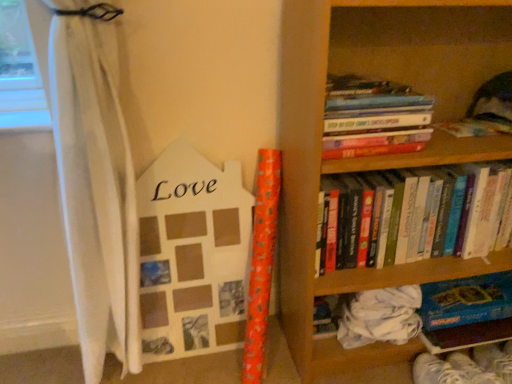
Describe the element at coordinates (374, 156) in the screenshot. I see `wooden bookcase at right` at that location.

Locate an element on the screen. The height and width of the screenshot is (384, 512). blue cardboard book at lower right, which appears as the 1th book when ordered from the bottom is located at coordinates (466, 312).

From a real-world perspective, is blue cardboard book at lower right, the third book viewed from the top, physically above hardcover books at upper right, positioned as the 2th book in bottom-to-top order?

Incorrect, from a real-world perspective, blue cardboard book at lower right, the third book viewed from the top, is lower than hardcover books at upper right, positioned as the 2th book in bottom-to-top order.

From the picture: Which of these two, blue cardboard book at lower right, the third book viewed from the top, or hardcover books at upper right, positioned as the 2th book in bottom-to-top order, is thinner?

Thinner between the two is blue cardboard book at lower right, the third book viewed from the top.

Locate an element on the screen. Image resolution: width=512 pixels, height=384 pixels. book below the hardcover books at upper right, positioned as the 2th book in bottom-to-top order (from a real-world perspective) is located at coordinates tap(466, 312).

Is point (288, 6) positioned in front of point (187, 265)?

Yes.

Which is in front, wooden bookcase at right or wooden photo frame at left?

wooden bookcase at right is closer to the camera.

How much distance is there between wooden bookcase at right and wooden photo frame at left?

A distance of 14.42 inches exists between wooden bookcase at right and wooden photo frame at left.

From the image's perspective, between wooden bookcase at right and wooden photo frame at left, which one is located above?

wooden bookcase at right is shown above in the image.

From a real-world perspective, which object rests below the other?

blue cardboard book at lower right, the third book viewed from the top, is physically lower.

Considering the points (447, 329) and (169, 353), which point is behind, point (447, 329) or point (169, 353)?

Positioned behind is point (169, 353).

Consider the image. Does blue cardboard book at lower right, the third book viewed from the top, have a lesser height compared to wooden photo frame at left?

Indeed, blue cardboard book at lower right, the third book viewed from the top, has a lesser height compared to wooden photo frame at left.

How many degrees apart are the facing directions of hardcover books at upper right, positioned as the 2th book in bottom-to-top order, and hardcover books at upper right, arranged as the 3th book when ordered from the bottom?

They differ by 2.15 degrees in their facing directions.

Which is closer, (439,219) or (365,109)?

Clearly, point (439,219) is more distant from the camera than point (365,109).

From the image's perspective, is hardcover books at upper right, positioned as the 2th book in bottom-to-top order, beneath hardcover books at upper right, arranged as the 3th book when ordered from the bottom?

Yes, from the image's perspective, hardcover books at upper right, positioned as the 2th book in bottom-to-top order, is below hardcover books at upper right, arranged as the 3th book when ordered from the bottom.

Could you measure the distance between hardcover books at upper right, which is counted as the first book, starting from the top, and wooden photo frame at left?

hardcover books at upper right, which is counted as the first book, starting from the top, and wooden photo frame at left are 20.21 inches apart.

Identify the location of the 1st book counting from the right of the wooden photo frame at left. This screenshot has height=384, width=512. (373, 118).

Which is closer to the camera, (368, 137) or (187, 294)?

Point (368, 137).

Considering the sizes of hardcover books at upper right, arranged as the 3th book when ordered from the bottom, and wooden photo frame at left in the image, is hardcover books at upper right, arranged as the 3th book when ordered from the bottom, bigger or smaller than wooden photo frame at left?

In the image, hardcover books at upper right, arranged as the 3th book when ordered from the bottom, appears to be smaller than wooden photo frame at left.

Is wooden photo frame at left bigger than hardcover books at upper right, arranged as the 3th book when ordered from the bottom?

Correct, wooden photo frame at left is larger in size than hardcover books at upper right, arranged as the 3th book when ordered from the bottom.

From the image's perspective, does wooden photo frame at left appear higher than hardcover books at upper right, which is counted as the first book, starting from the top?

Actually, wooden photo frame at left appears below hardcover books at upper right, which is counted as the first book, starting from the top, in the image.

Identify the location of paperback book below the hardcover books at upper right, arranged as the 3th book when ordered from the bottom (from the image's perspective). This screenshot has height=384, width=512. (192, 254).

Is wooden photo frame at left closer to the viewer compared to hardcover books at upper right, which is counted as the first book, starting from the top?

No.

From a real-world perspective, is wooden bookcase at right positioned above or below hardcover books at upper right, positioned as the 2th book in bottom-to-top order?

wooden bookcase at right is above hardcover books at upper right, positioned as the 2th book in bottom-to-top order.

Is wooden bookcase at right facing away from hardcover books at upper right, positioned as the 2th book in bottom-to-top order?

→ Yes, wooden bookcase at right is positioned with its back facing hardcover books at upper right, positioned as the 2th book in bottom-to-top order.

Which is closer to the camera, [282,43] or [325,212]?

Point [282,43] is farther from the camera than point [325,212].

Image resolution: width=512 pixels, height=384 pixels. Identify the location of book lying below the hardcover books at upper right, positioned as the 2th book in bottom-to-top order (from the image's perspective). (466, 312).

Image resolution: width=512 pixels, height=384 pixels. In order to click on paperback book beneath the wooden bookcase at right (from a real-world perspective) in this screenshot , I will do `click(192, 254)`.

Looking at the image, which one is located further to hardcover books at upper right, arranged as the 3th book when ordered from the bottom, wooden photo frame at left or hardcover books at upper right, which is the second book in top-to-bottom order?

wooden photo frame at left lies further to hardcover books at upper right, arranged as the 3th book when ordered from the bottom, than the other object.

Considering their positions, is blue cardboard book at lower right, which appears as the 1th book when ordered from the bottom, positioned closer to hardcover books at upper right, which is the second book in top-to-bottom order, than wooden bookcase at right?

wooden bookcase at right is closer to hardcover books at upper right, which is the second book in top-to-bottom order.

Considering their positions, is hardcover books at upper right, which is counted as the first book, starting from the top, positioned further to blue cardboard book at lower right, the third book viewed from the top, than wooden photo frame at left?

Among the two, wooden photo frame at left is located further to blue cardboard book at lower right, the third book viewed from the top.

From the image, which object appears to be farther from wooden bookcase at right, hardcover books at upper right, which is the second book in top-to-bottom order, or hardcover books at upper right, arranged as the 3th book when ordered from the bottom?

Based on the image, hardcover books at upper right, arranged as the 3th book when ordered from the bottom, appears to be further to wooden bookcase at right.

Looking at this image, from the image, which object appears to be farther from blue cardboard book at lower right, the third book viewed from the top, hardcover books at upper right, which is counted as the first book, starting from the top, or wooden bookcase at right?

hardcover books at upper right, which is counted as the first book, starting from the top.

Estimate the real-world distances between objects in this image. Which object is further from hardcover books at upper right, positioned as the 2th book in bottom-to-top order, blue cardboard book at lower right, which appears as the 1th book when ordered from the bottom, or wooden photo frame at left?

Among the two, wooden photo frame at left is located further to hardcover books at upper right, positioned as the 2th book in bottom-to-top order.

From the image, which object appears to be farther from hardcover books at upper right, arranged as the 3th book when ordered from the bottom, wooden photo frame at left or blue cardboard book at lower right, which appears as the 1th book when ordered from the bottom?

Among the two, blue cardboard book at lower right, which appears as the 1th book when ordered from the bottom, is located further to hardcover books at upper right, arranged as the 3th book when ordered from the bottom.

Looking at the image, which one is located closer to wooden photo frame at left, hardcover books at upper right, positioned as the 2th book in bottom-to-top order, or blue cardboard book at lower right, the third book viewed from the top?

hardcover books at upper right, positioned as the 2th book in bottom-to-top order, lies closer to wooden photo frame at left than the other object.

Locate an element on the screen. This screenshot has height=384, width=512. bookcase between hardcover books at upper right, which is counted as the first book, starting from the top, and blue cardboard book at lower right, the third book viewed from the top, vertically is located at coordinates (374, 156).

Image resolution: width=512 pixels, height=384 pixels. Find the location of `bookcase located between hardcover books at upper right, arranged as the 3th book when ordered from the bottom, and hardcover books at upper right, which is the second book in top-to-bottom order, in the left-right direction`. bookcase located between hardcover books at upper right, arranged as the 3th book when ordered from the bottom, and hardcover books at upper right, which is the second book in top-to-bottom order, in the left-right direction is located at coordinates (374, 156).

At what (x,y) coordinates should I click in order to perform the action: click on book between wooden photo frame at left and wooden bookcase at right. Please return your answer as a coordinate pair (x, y). Image resolution: width=512 pixels, height=384 pixels. Looking at the image, I should click on (373, 118).

The height and width of the screenshot is (384, 512). Identify the location of bookcase between wooden photo frame at left and hardcover books at upper right, positioned as the 2th book in bottom-to-top order, from left to right. (374, 156).